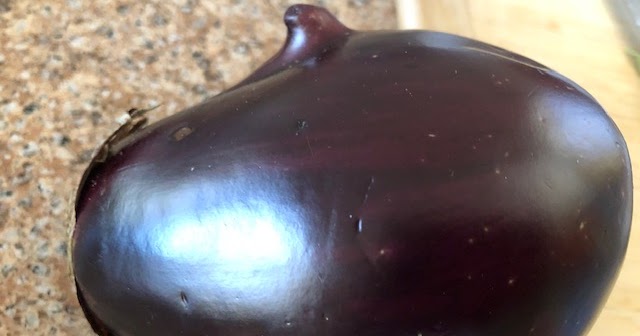
You are a GUI agent. You are given a task and a screenshot of the screen. Output one action in this format:
    pyautogui.click(x=<x>, y=<y>)
    Task: Click on the beige rim on counter
    The image size is (640, 336).
    Given the screenshot: What is the action you would take?
    pyautogui.click(x=404, y=19)